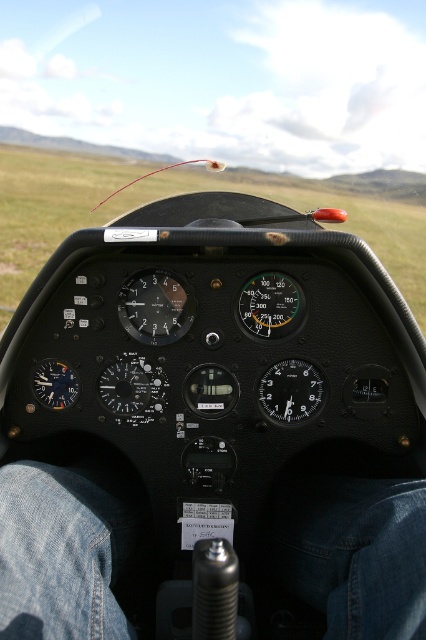
Question: Which object is closer to the camera taking this photo?

Choices:
 (A) green grass at center
 (B) jeans at lower center

Answer: (B)

Question: Does jeans at lower center have a lesser width compared to green grass at center?

Choices:
 (A) yes
 (B) no

Answer: (A)

Question: Which of the following is the farthest from the observer?

Choices:
 (A) (399, 513)
 (B) (152, 186)

Answer: (B)

Question: Where is jeans at lower center located in relation to green grass at center in the image?

Choices:
 (A) below
 (B) above

Answer: (A)

Question: Does jeans at lower center appear under green grass at center?

Choices:
 (A) no
 (B) yes

Answer: (B)